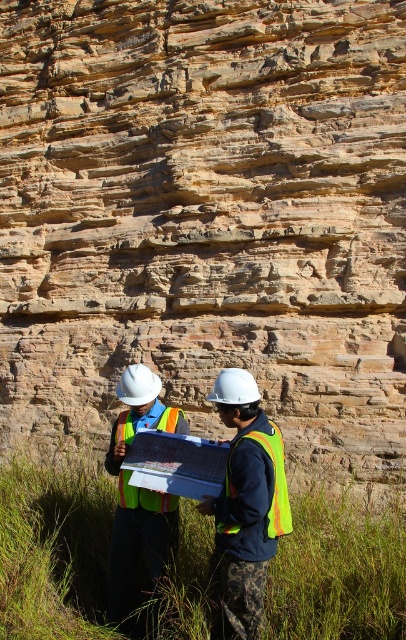
You are a safety inspector assessing the equipment in the image. You need to determine if the matte plastic clipboard at center can be stored inside the high visibility fabric safety vest at lower right. Based on their sizes, what do you conclude?

The matte plastic clipboard at center has a lesser height compared to the high visibility fabric safety vest at lower right, so it is possible that the clipboard could fit inside the vest if the vest has sufficient storage compartments or pockets designed to accommodate its size.

You are a safety inspector reviewing the image of two workers at a construction site. Both workers are wearing safety gear. The image shows a reflective safety vest at center and a reflective yellow safety vest at center. Which safety vest is larger?

The reflective safety vest at center is bigger than the reflective yellow safety vest at center.

You are a safety inspector evaluating the visibility of safety gear in the image. You need to determine which safety vest is more visible from above. Which one is taller between the reflective safety vest at center and the high visibility fabric safety vest at lower right?

The reflective safety vest at center is much taller than the high visibility fabric safety vest at lower right, so it would be more visible from above.